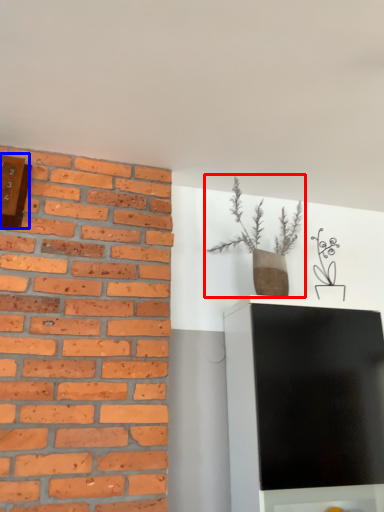
Question: Which of the following is the closest to the observer, houseplant (highlighted by a red box) or clock (highlighted by a blue box)?

Choices:
 (A) houseplant
 (B) clock

Answer: (B)